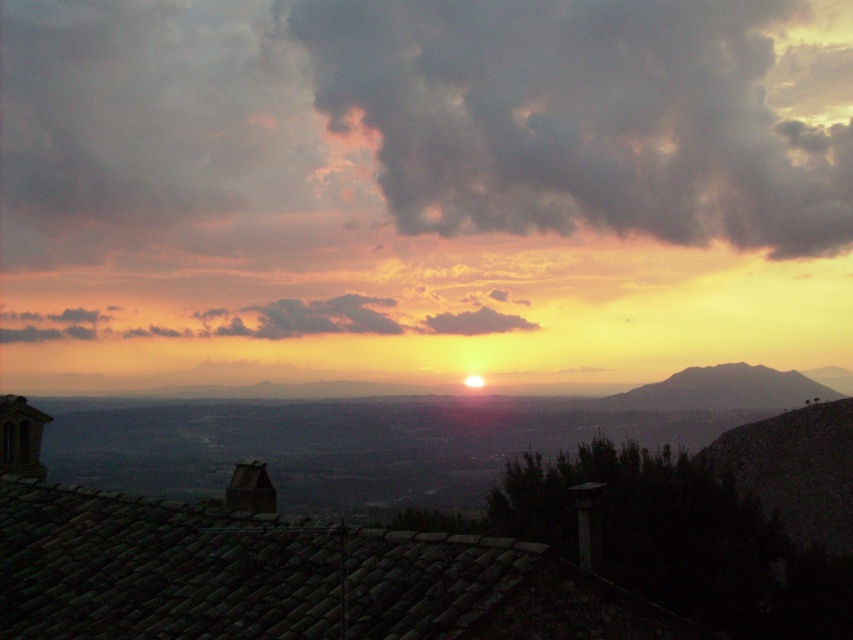
Question: Which point appears closest to the camera in this image?

Choices:
 (A) (318, 332)
 (B) (560, 179)
 (C) (677, 385)

Answer: (C)

Question: Which object is closer to the camera taking this photo?

Choices:
 (A) cloudy sky at center
 (B) dark gray cloud at upper center
 (C) silhouetted rock formation at right

Answer: (C)

Question: Does cloudy sky at center have a larger size compared to silhouetted rock formation at right?

Choices:
 (A) no
 (B) yes

Answer: (B)

Question: Does dark gray cloud at upper center have a lesser width compared to cloudy sky at center?

Choices:
 (A) no
 (B) yes

Answer: (A)

Question: Which of the following is the farthest from the observer?

Choices:
 (A) (276, 301)
 (B) (560, 77)
 (C) (781, 404)

Answer: (B)

Question: Can you confirm if dark gray cloud at upper center is thinner than cloudy sky at center?

Choices:
 (A) no
 (B) yes

Answer: (A)